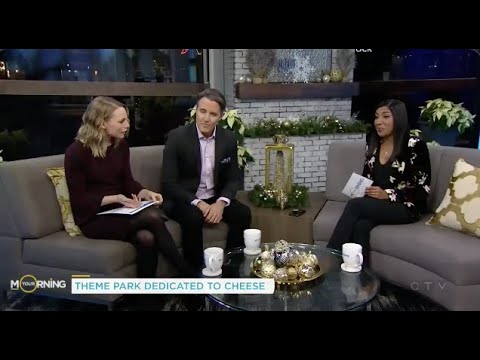
Locate an element on the screen. coffee cups is located at coordinates (219, 258), (252, 240), (349, 256).